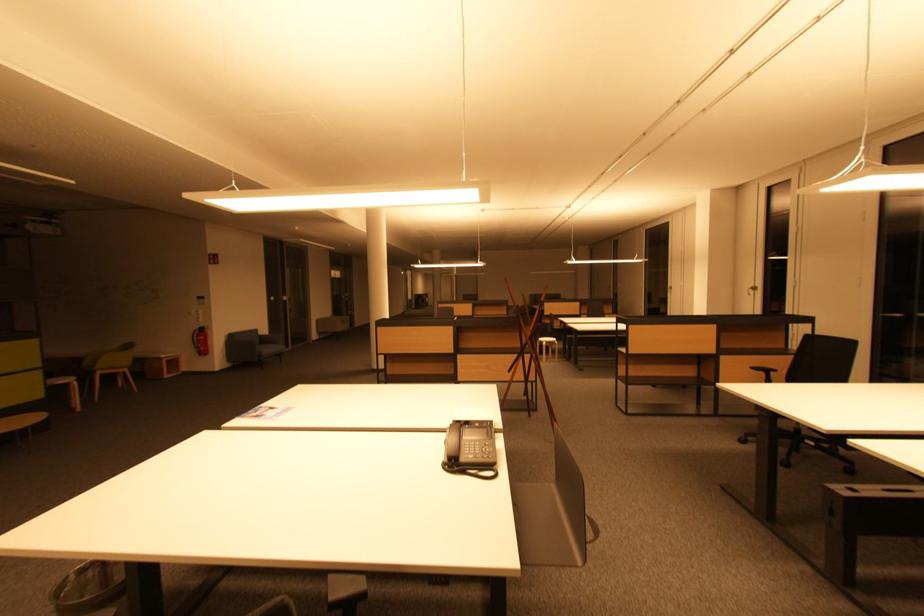
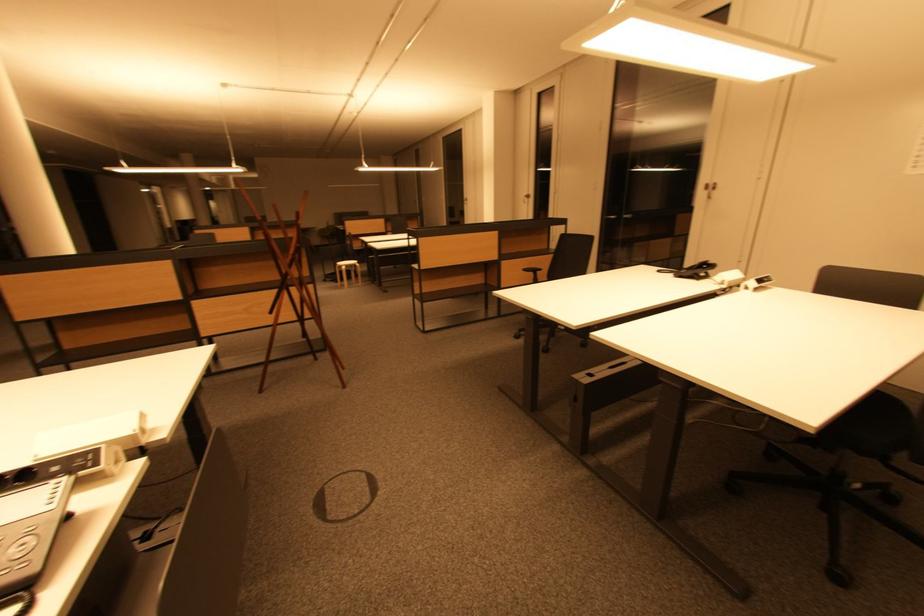
Question: The first image is from the beginning of the video and the second image is from the end. How did the camera likely rotate when shooting the video?

Choices:
 (A) Left
 (B) Right
 (C) Up
 (D) Down

Answer: (B)